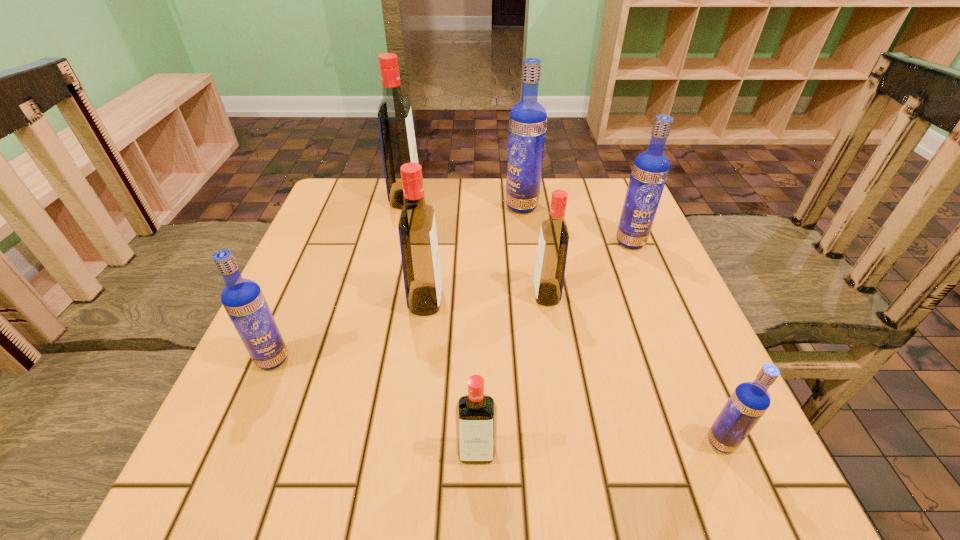
Where is `the leftmost red vodka`? The height and width of the screenshot is (540, 960). the leftmost red vodka is located at coordinates (396, 129).

The height and width of the screenshot is (540, 960). Identify the location of the seventh object from right to left. (396, 129).

The width and height of the screenshot is (960, 540). Find the location of `the biggest blue vodka`. the biggest blue vodka is located at coordinates (528, 119).

Image resolution: width=960 pixels, height=540 pixels. Identify the location of the second blue vodka from left to right. (528, 119).

I want to click on the third nearest blue vodka, so coord(650,169).

Find the location of a particular element. This screenshot has height=540, width=960. the third farthest object is located at coordinates (650, 169).

Where is `the third vodka from left to right`? the third vodka from left to right is located at coordinates (420, 258).

Locate an element on the screen. Image resolution: width=960 pixels, height=540 pixels. the third red vodka from right to left is located at coordinates (420, 258).

The width and height of the screenshot is (960, 540). What are the coordinates of `the third nearest object` in the screenshot? It's located at (243, 299).

Identify the location of the leftmost blue vodka. This screenshot has width=960, height=540. (243, 299).